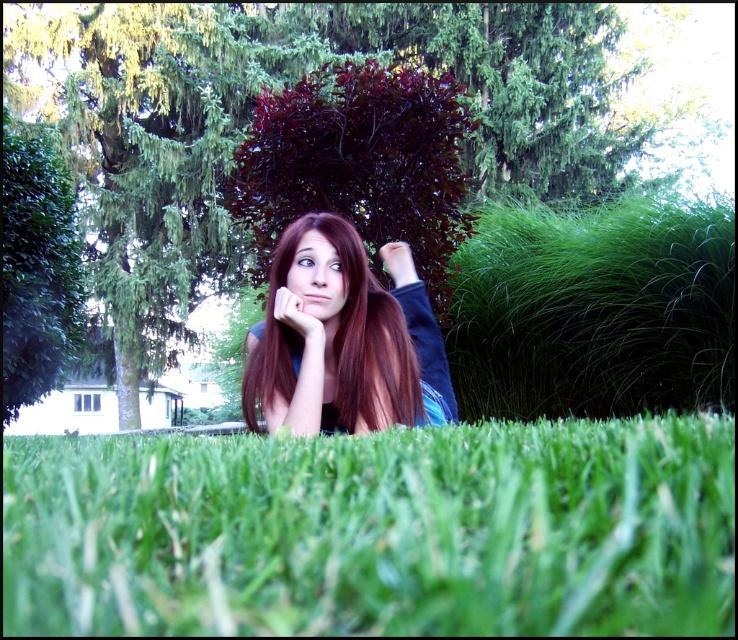
Question: Estimate the real-world distances between objects in this image. Which object is farther from the matte black hand at upper center?

Choices:
 (A) shiny brown hair at center
 (B) matte skin hand at center
 (C) green grass at lower center

Answer: (C)

Question: Which point is farther to the camera?

Choices:
 (A) green grass at lower center
 (B) shiny brown hair at center

Answer: (B)

Question: Is green grass at lower center bigger than shiny brown hair at center?

Choices:
 (A) yes
 (B) no

Answer: (A)

Question: Does green grass at lower center have a larger size compared to shiny brown hair at center?

Choices:
 (A) yes
 (B) no

Answer: (A)

Question: Which point is farther to the camera?

Choices:
 (A) (320, 314)
 (B) (124, 525)
 (C) (393, 276)
 (D) (300, 332)

Answer: (C)

Question: Can you confirm if shiny brown hair at center is positioned above matte black hand at upper center?

Choices:
 (A) no
 (B) yes

Answer: (A)